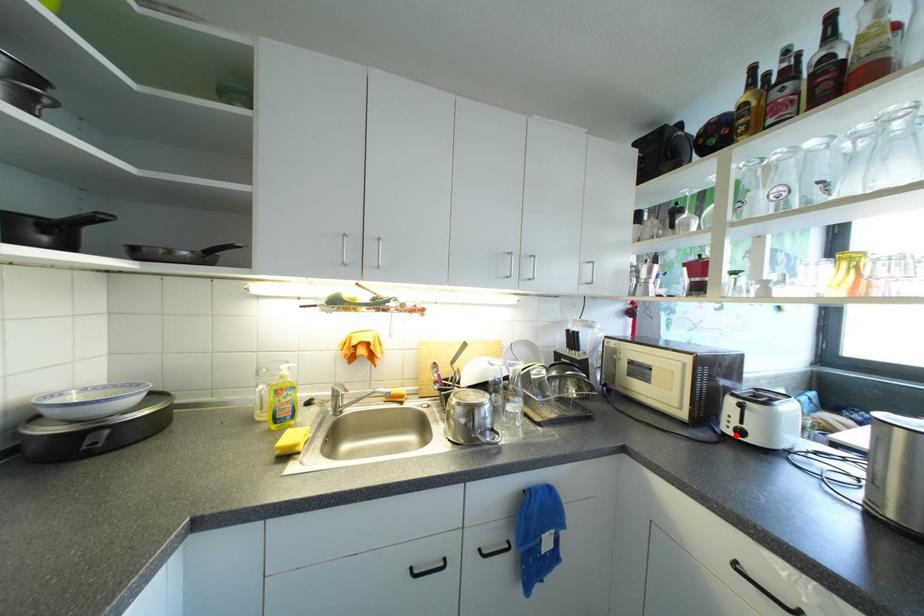
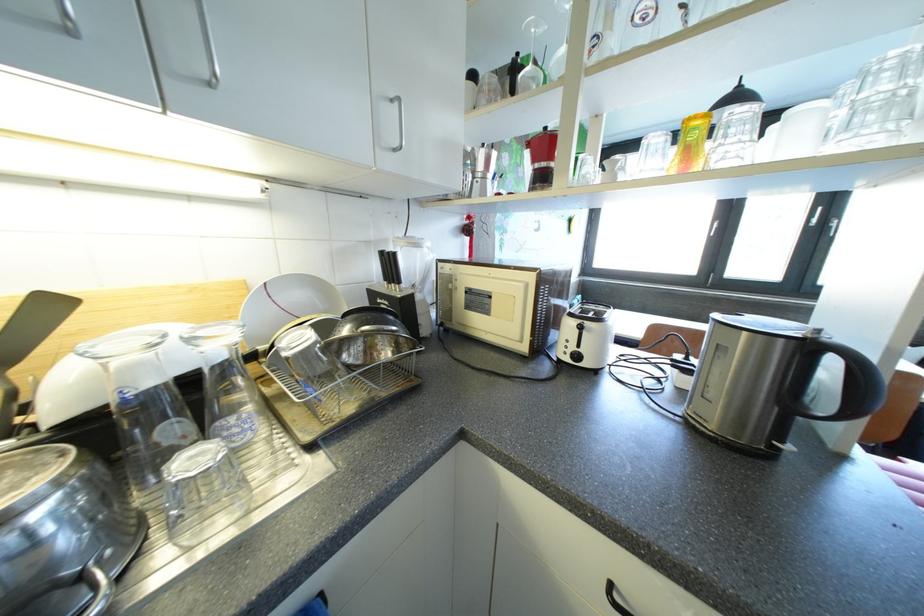
Find the pixel in the second image that matches the highlighted location in the first image.

(573, 362)